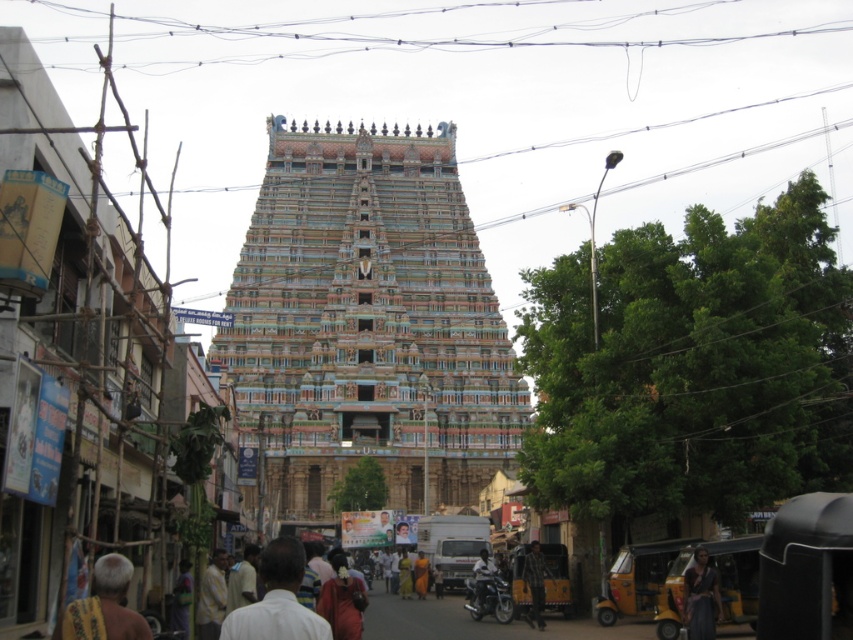
You are a tourist standing at the entrance of the temple and want to take a photo that includes both the multicolored painted temple at center and the plaid fabric person at lower center. Which object should be placed closer to the camera to ensure both are in focus?

The multicolored painted temple at center is larger than the plaid fabric person at lower center, so to ensure both are in focus, the plaid fabric person at lower center should be placed closer to the camera.

You are a tourist standing at the entrance of the temple. You notice the multicolored painted temple at center and the dark gray fabric at lower right. Which object is positioned higher in the image?

The multicolored painted temple at center is above dark gray fabric at lower right, so the multicolored painted temple at center is positioned higher in the image.

You are standing in the South Indian town street scene. You see a point at coordinates [367,323]. Which object from the scene does this point belong to?

The point at coordinates [367,323] belongs to the multicolored painted temple at center.